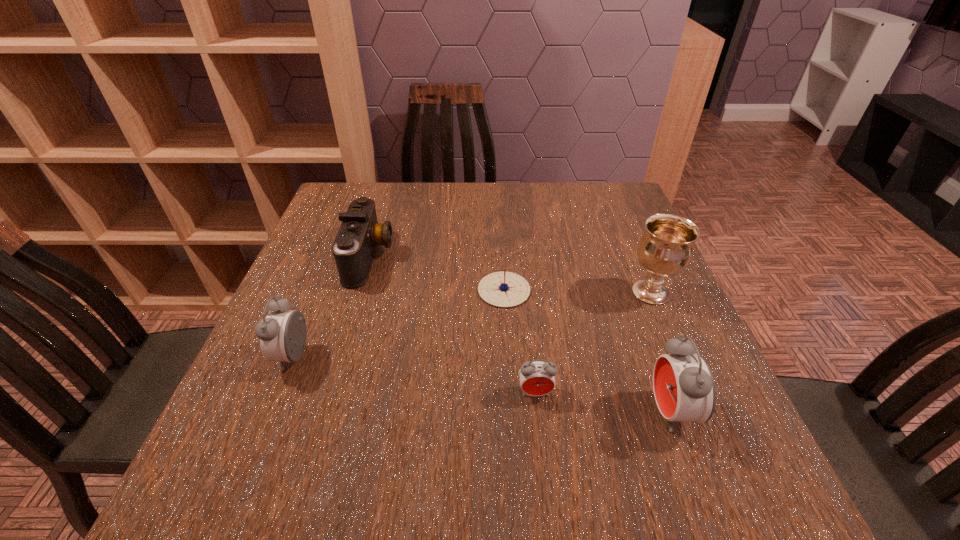
Locate an element on the screen. empty location between the fifth object from right to left and the compass is located at coordinates (437, 274).

You are a GUI agent. You are given a task and a screenshot of the screen. Output one action in this format:
    pyautogui.click(x=<x>, y=<y>)
    Task: Click on the free space between the second alarm clock from left to right and the second tallest alarm clock
    The image size is (960, 540).
    Given the screenshot: What is the action you would take?
    pyautogui.click(x=415, y=375)

You are a GUI agent. You are given a task and a screenshot of the screen. Output one action in this format:
    pyautogui.click(x=<x>, y=<y>)
    Task: Click on the empty space between the third tallest object and the camera
    This screenshot has width=960, height=540.
    Given the screenshot: What is the action you would take?
    pyautogui.click(x=331, y=307)

The image size is (960, 540). Identify the location of vacant space that's between the rightmost alarm clock and the fourth shortest object. (482, 385).

The height and width of the screenshot is (540, 960). What are the coordinates of `free space between the second object from left to right and the compass` in the screenshot? It's located at [x=437, y=274].

The height and width of the screenshot is (540, 960). I want to click on unoccupied position between the camera and the shortest object, so click(437, 274).

Identify the location of free space that is in between the second alarm clock from left to right and the rightmost alarm clock. pyautogui.click(x=603, y=402).

Find the location of a particular element. This screenshot has width=960, height=540. object that is the third closest one to the shortest object is located at coordinates point(665,249).

At what (x,y) coordinates should I click in order to perform the action: click on the third closest object to the second object from left to right. Please return your answer as a coordinate pair (x, y). The image size is (960, 540). Looking at the image, I should click on (537, 378).

The image size is (960, 540). I want to click on the second closest alarm clock to the rightmost alarm clock, so click(x=282, y=334).